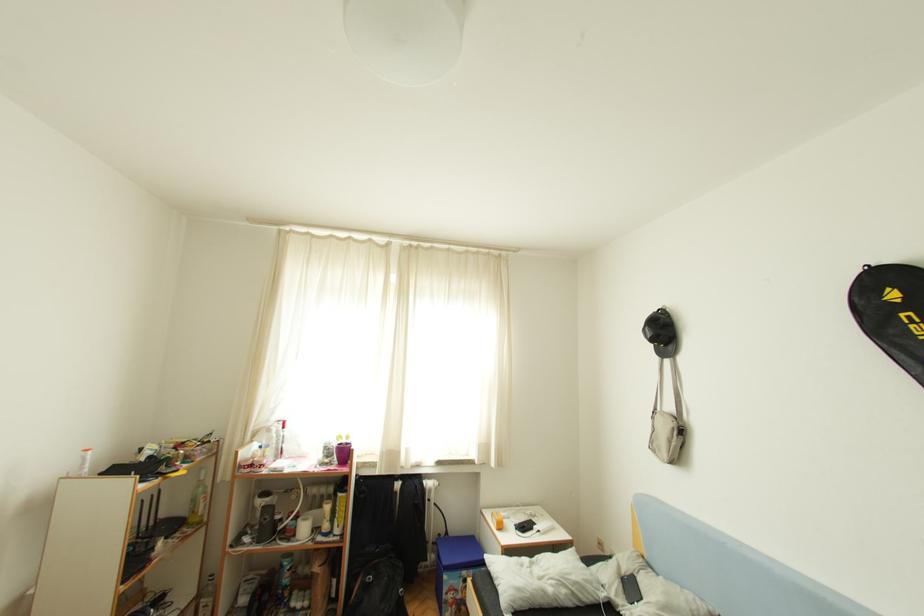
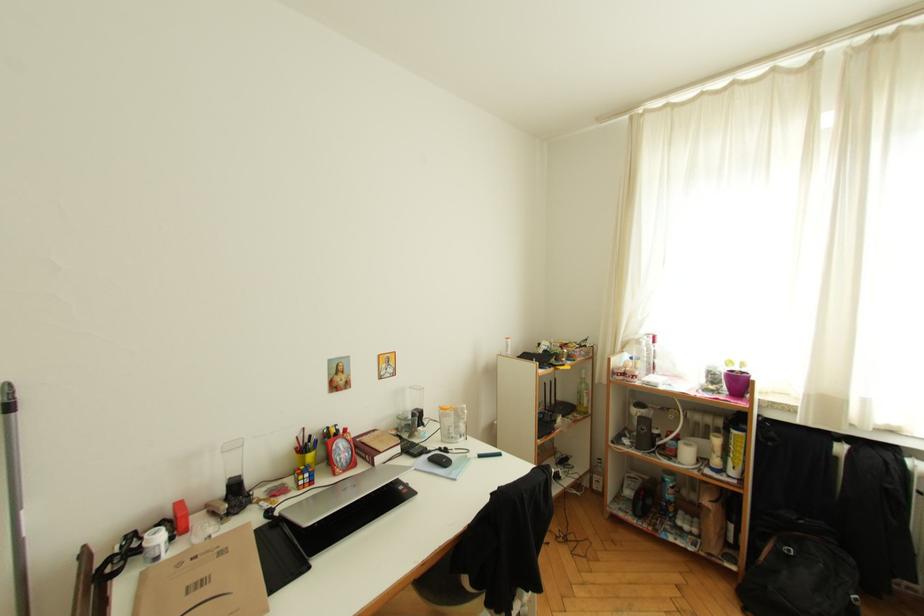
Question: The first image is from the beginning of the video and the second image is from the end. How did the camera likely rotate when shooting the video?

Choices:
 (A) Left
 (B) Right
 (C) Up
 (D) Down

Answer: (A)